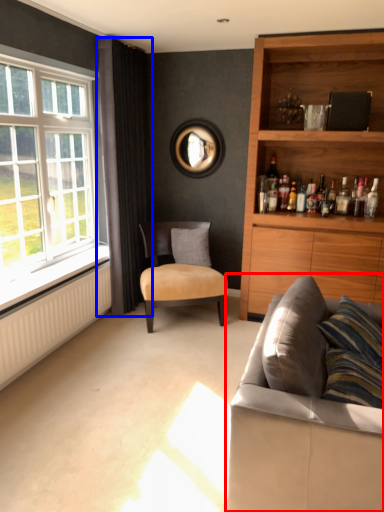
Question: Which object appears farthest to the camera in this image, studio couch (highlighted by a red box) or curtain (highlighted by a blue box)?

Choices:
 (A) studio couch
 (B) curtain

Answer: (B)